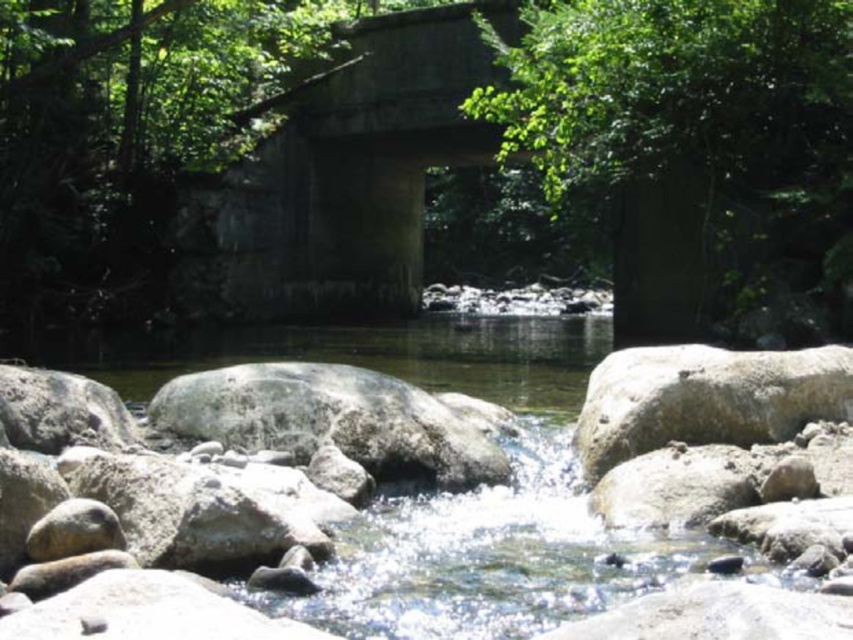
Based on the photo, you are a hiker trying to cross the stream. You see the green leafy tree at center and the gray rough boulder at right. Which object is closer to you as you stand on the near side of the stream?

The gray rough boulder at right is closer to you because the green leafy tree at center is positioned over it, meaning the tree is further away.

You are standing at the left edge of the stream and want to walk to the gray rough boulder at right. Which direction should you head towards to avoid the green leafy tree at center?

You should head to the left of the green leafy tree at center to reach the gray rough boulder at right without going near the tree.